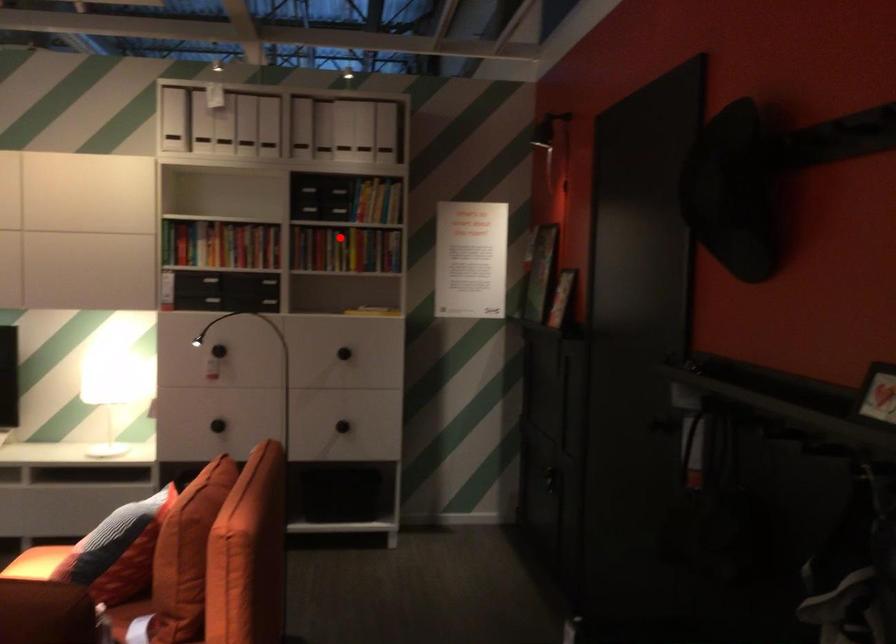
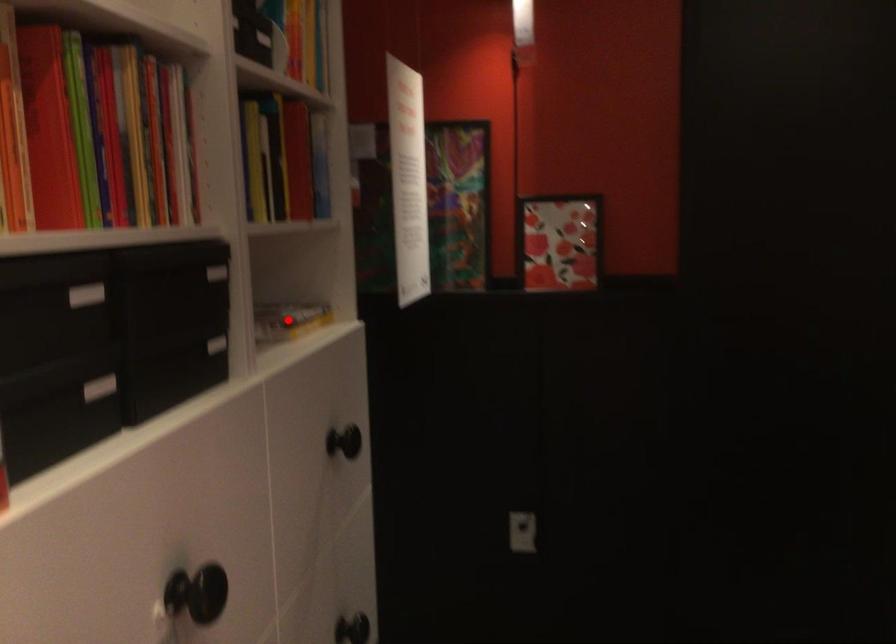
I am providing you with two images of the same scene from different viewpoints. A red point is marked on the first image and another point is marked on the second image. Does the point marked in image1 correspond to the same location as the one in image2?

No